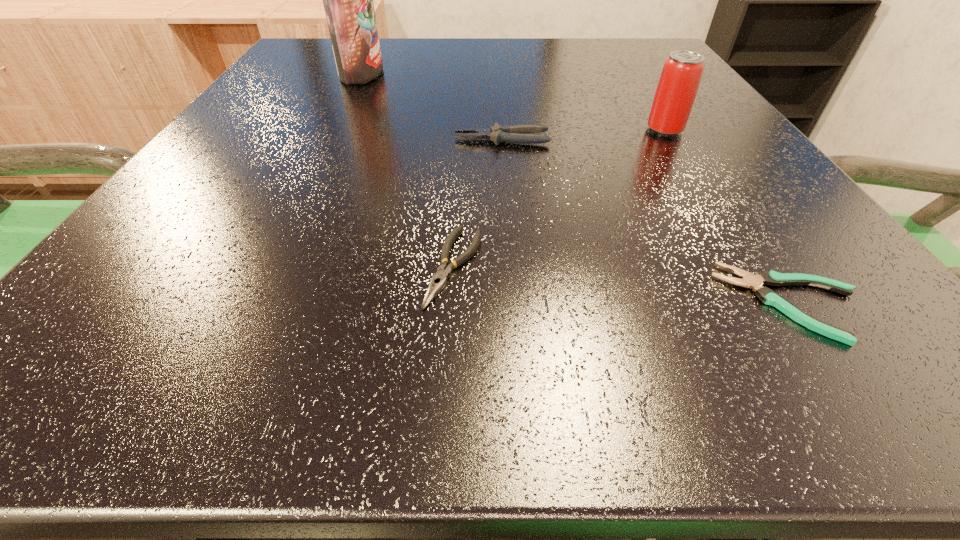
Image resolution: width=960 pixels, height=540 pixels. In order to click on object present at the near right corner in this screenshot , I will do `click(769, 297)`.

This screenshot has height=540, width=960. In order to click on vacant space at the far edge in this screenshot , I will do `click(485, 56)`.

You are a GUI agent. You are given a task and a screenshot of the screen. Output one action in this format:
    pyautogui.click(x=<x>, y=<y>)
    Task: Click on the free space at the near edge
    
    Given the screenshot: What is the action you would take?
    pyautogui.click(x=689, y=365)

In the image, there is a desktop. Where is `free space at the left edge`? Image resolution: width=960 pixels, height=540 pixels. free space at the left edge is located at coordinates (258, 210).

Locate an element on the screen. The image size is (960, 540). vacant space at the right edge is located at coordinates (810, 265).

Image resolution: width=960 pixels, height=540 pixels. In the image, there is a desktop. Identify the location of free region at the far right corner. (648, 39).

You are a GUI agent. You are given a task and a screenshot of the screen. Output one action in this format:
    pyautogui.click(x=<x>, y=<y>)
    Task: Click on the vacant space that is in between the shortest object and the fourth tallest object
    This screenshot has width=960, height=540.
    Given the screenshot: What is the action you would take?
    pyautogui.click(x=623, y=285)

At what (x,y) coordinates should I click in order to perform the action: click on free space between the tallest pliers and the shortest object. Please return your answer as a coordinate pair (x, y). This screenshot has width=960, height=540. Looking at the image, I should click on (647, 221).

This screenshot has width=960, height=540. I want to click on free area in between the tallest pliers and the fourth shortest object, so click(584, 134).

The image size is (960, 540). In order to click on free space between the shortest pliers and the second shortest pliers in this screenshot , I will do `click(623, 285)`.